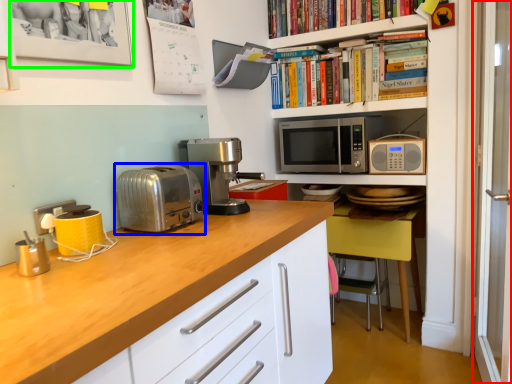
Question: Which object is positioned closest to glass door (highlighted by a red box)? Select from toaster (highlighted by a blue box) and picture frame (highlighted by a green box).

Choices:
 (A) toaster
 (B) picture frame

Answer: (A)